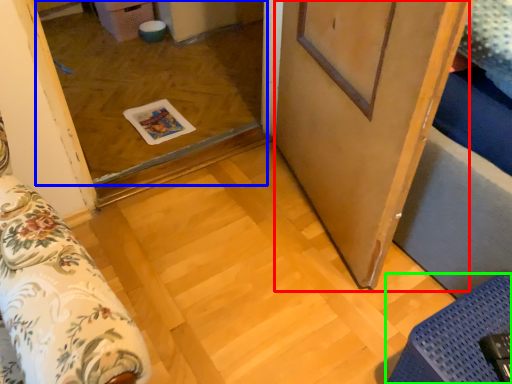
Question: Which object is positioned closest to barn door (highlighted by a red box)? Select from window (highlighted by a blue box) and furniture (highlighted by a green box).

Choices:
 (A) window
 (B) furniture

Answer: (B)